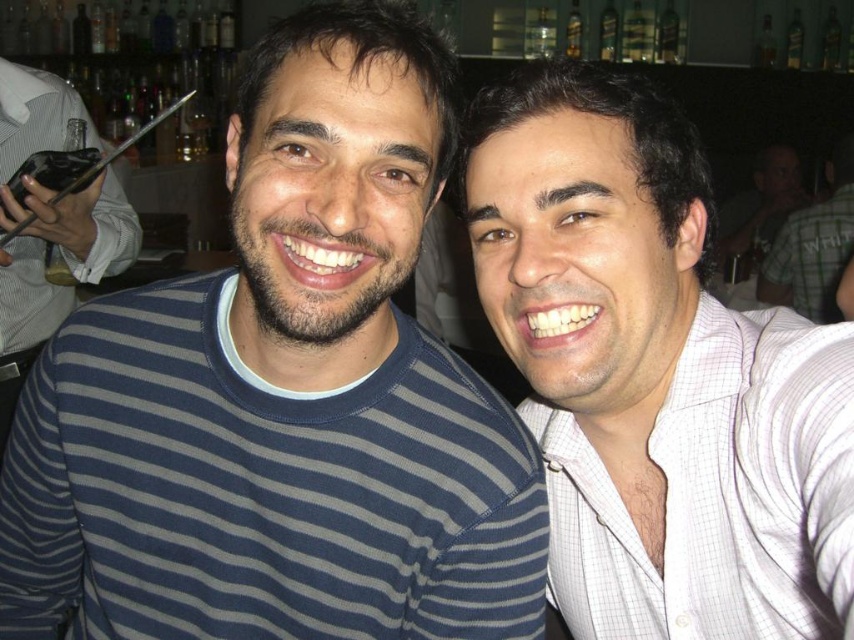
Is blue striped sweater at center bigger than white checkered shirt at upper right?

Actually, blue striped sweater at center might be smaller than white checkered shirt at upper right.

Who is more forward, (118, 458) or (825, 250)?

Point (118, 458) is in front.

Which is behind, point (138, 604) or point (814, 225)?

Point (814, 225)

Locate an element on the screen. blue striped sweater at center is located at coordinates (282, 396).

Is matte black phone at left below black glossy phone at upper left?

Indeed, matte black phone at left is positioned under black glossy phone at upper left.

The image size is (854, 640). What do you see at coordinates (50, 221) in the screenshot? I see `matte black phone at left` at bounding box center [50, 221].

I want to click on matte black phone at left, so click(x=50, y=221).

This screenshot has width=854, height=640. Describe the element at coordinates (654, 376) in the screenshot. I see `white checkered shirt at right` at that location.

In the scene shown: Does white checkered shirt at right have a lesser height compared to white checkered shirt at upper right?

Correct, white checkered shirt at right is not as tall as white checkered shirt at upper right.

Where is `white checkered shirt at right`? The height and width of the screenshot is (640, 854). white checkered shirt at right is located at coordinates (654, 376).